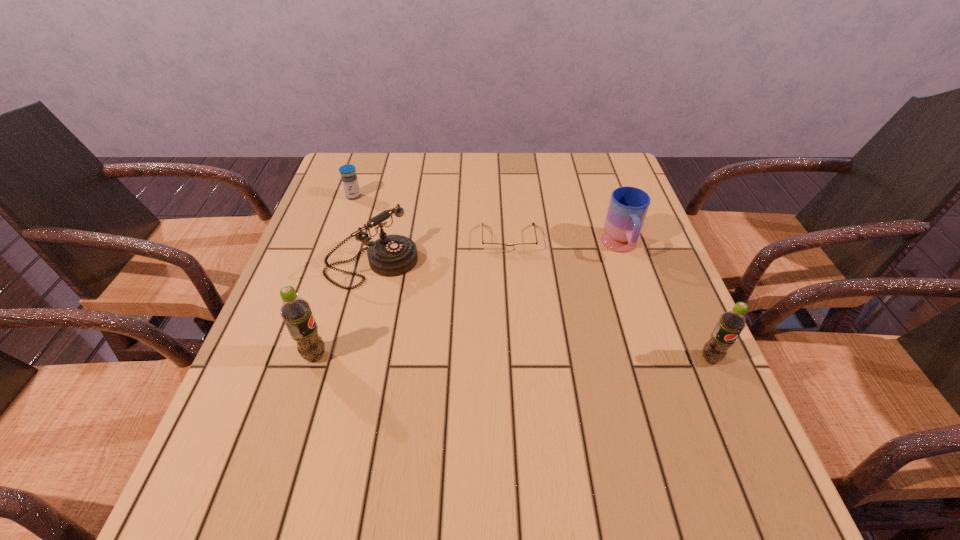
Locate an element on the screen. The height and width of the screenshot is (540, 960). soda located in the right edge section of the desktop is located at coordinates (731, 323).

You are a GUI agent. You are given a task and a screenshot of the screen. Output one action in this format:
    pyautogui.click(x=<x>, y=<y>)
    Task: Click on the mug located in the right edge section of the desktop
    
    Given the screenshot: What is the action you would take?
    pyautogui.click(x=628, y=206)

Image resolution: width=960 pixels, height=540 pixels. I want to click on object present at the far left corner, so click(349, 179).

Identify the location of free space at the far edge of the desktop. This screenshot has width=960, height=540. (510, 166).

The image size is (960, 540). I want to click on free space at the near edge, so click(x=471, y=419).

At what (x,y) coordinates should I click in order to perform the action: click on vacant space at the left edge of the desktop. Please return your answer as a coordinate pair (x, y). The image size is (960, 540). Looking at the image, I should click on (342, 292).

This screenshot has width=960, height=540. I want to click on vacant space at the right edge, so click(x=638, y=338).

In order to click on vacant space at the far right corner in this screenshot , I will do `click(592, 160)`.

This screenshot has width=960, height=540. What are the coordinates of `free space between the spectacles and the second shortest object` in the screenshot? It's located at (431, 218).

You are a GUI agent. You are given a task and a screenshot of the screen. Output one action in this format:
    pyautogui.click(x=<x>, y=<y>)
    Task: Click on the free area in between the shorter soda and the telephone
    
    Given the screenshot: What is the action you would take?
    pyautogui.click(x=541, y=311)